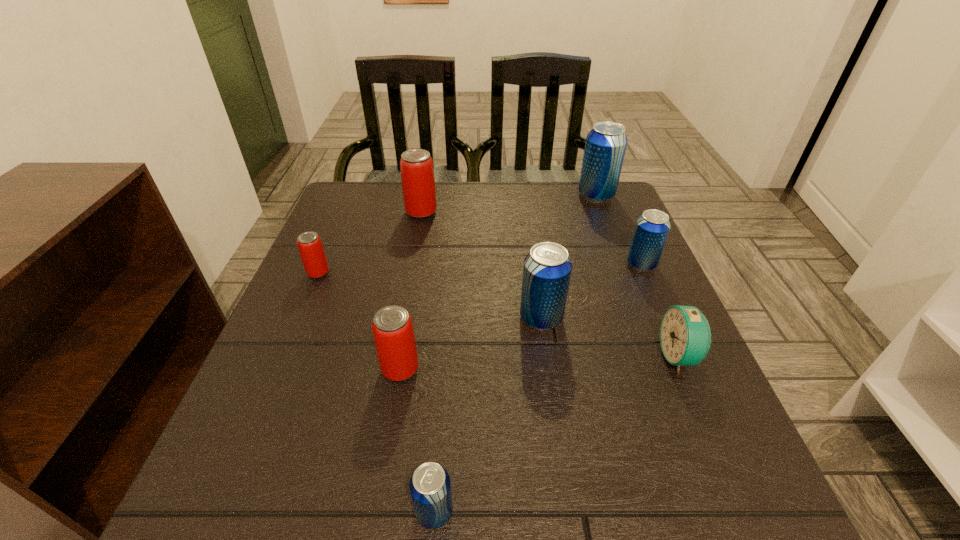
In the image, there is a desktop. In order to click on blank space at the right edge in this screenshot , I will do `click(692, 443)`.

This screenshot has width=960, height=540. Find the location of `free space at the far left corner`. free space at the far left corner is located at coordinates (394, 187).

Where is `free space at the near right corner`? The image size is (960, 540). free space at the near right corner is located at coordinates (721, 515).

The width and height of the screenshot is (960, 540). I want to click on empty space that is in between the farthest pink beer can and the nearest beer can, so click(x=428, y=362).

Where is `unoccupied position between the third nearest blue beer can and the second farthest pink beer can`? The image size is (960, 540). unoccupied position between the third nearest blue beer can and the second farthest pink beer can is located at coordinates (480, 268).

Where is `vacant region between the third smallest blue beer can and the third biggest blue beer can`? vacant region between the third smallest blue beer can and the third biggest blue beer can is located at coordinates (591, 291).

The image size is (960, 540). In order to click on vacant area that lies between the fifth object from left to right and the leftmost object in this screenshot , I will do point(430,295).

Where is `free point between the third biggest blue beer can and the sixth farthest beer can`? The height and width of the screenshot is (540, 960). free point between the third biggest blue beer can and the sixth farthest beer can is located at coordinates (521, 316).

Locate an element on the screen. Image resolution: width=960 pixels, height=540 pixels. empty space between the biggest pink beer can and the third beer can from right to left is located at coordinates (481, 265).

Where is `free spot between the second smallest blue beer can and the nearest pink beer can`? This screenshot has width=960, height=540. free spot between the second smallest blue beer can and the nearest pink beer can is located at coordinates (521, 316).